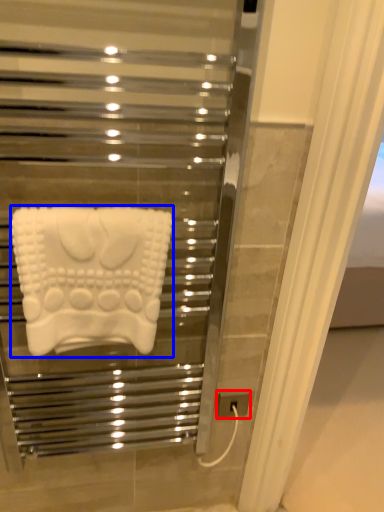
Question: Which point is closer to the camera, electric outlet (highlighted by a red box) or towel (highlighted by a blue box)?

Choices:
 (A) electric outlet
 (B) towel

Answer: (B)